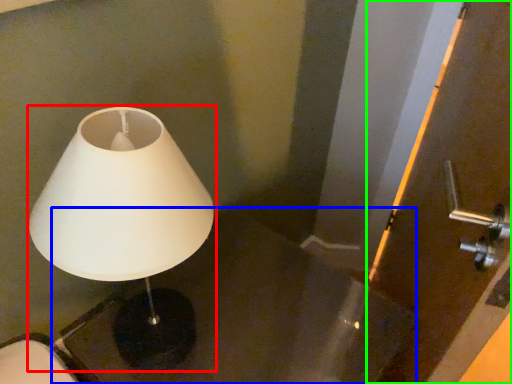
Question: Which object is positioned closest to lamp (highlighted by a red box)? Select from table (highlighted by a blue box) and screen door (highlighted by a green box).

Choices:
 (A) table
 (B) screen door

Answer: (A)